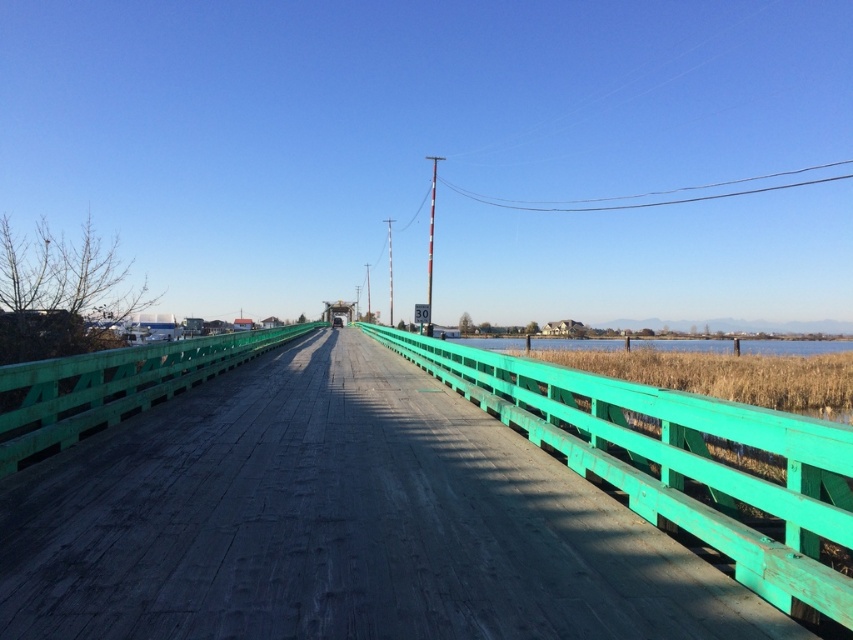
You are standing on the wooden bridge and see two points marked on the image. The first point is at coordinates point [228,605] and the second is at point [561,346]. Which point is closer to you as you face the direction the bridge extends?

Point [228,605] is in front of point [561,346], so the first point is closer to you.

You are standing at the starting point of the green wooden bridge at center. If you walk straight ahead, which direction will you face after crossing the bridge? Please answer based on the coordinates provided in the Objects Description.

The green wooden bridge at center is located at coordinates point (x=340, y=524). Since the bridge extends into the distance, walking straight ahead along the bridge would lead you toward the structure at the far end, which is positioned beyond the bridge. Therefore, you will face the direction of the structure after crossing the bridge.